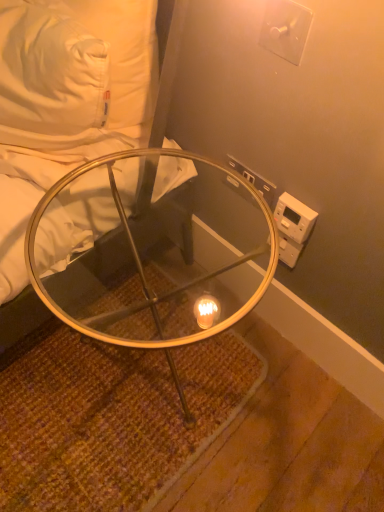
Identify the location of vacant space in front of clear glass table at center. click(133, 474).